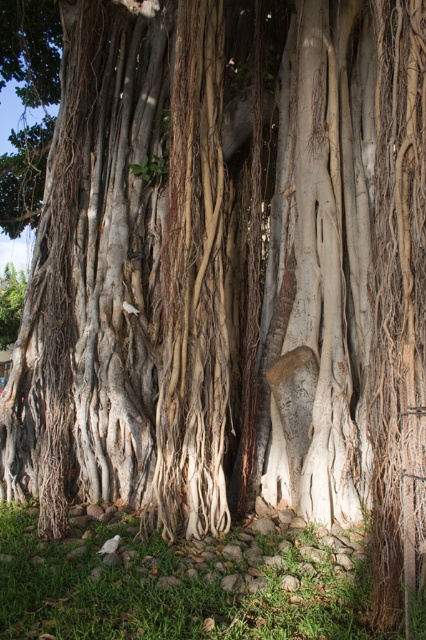
Question: Is white textured bark at center bigger than white rough bark at center?

Choices:
 (A) yes
 (B) no

Answer: (A)

Question: Which point is closer to the camera taking this photo?

Choices:
 (A) (149, 252)
 (B) (344, 296)

Answer: (B)

Question: Is white textured bark at center above white rough bark at center?

Choices:
 (A) yes
 (B) no

Answer: (A)

Question: Is white textured bark at center thinner than white rough bark at center?

Choices:
 (A) no
 (B) yes

Answer: (A)

Question: Which point is closer to the camera?

Choices:
 (A) (129, 92)
 (B) (333, 358)

Answer: (B)

Question: Which point is farther to the camera?

Choices:
 (A) (368, 61)
 (B) (78, 166)

Answer: (B)